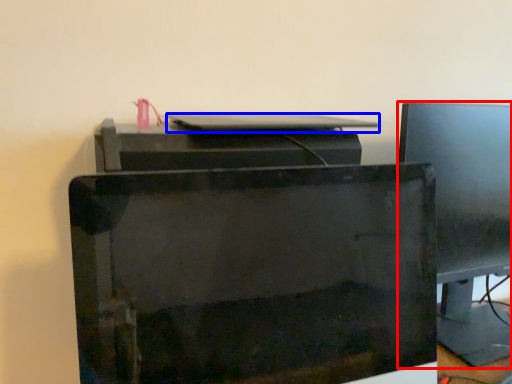
Question: Which point is further to the camera, computer monitor (highlighted by a red box) or desktop (highlighted by a blue box)?

Choices:
 (A) computer monitor
 (B) desktop

Answer: (A)